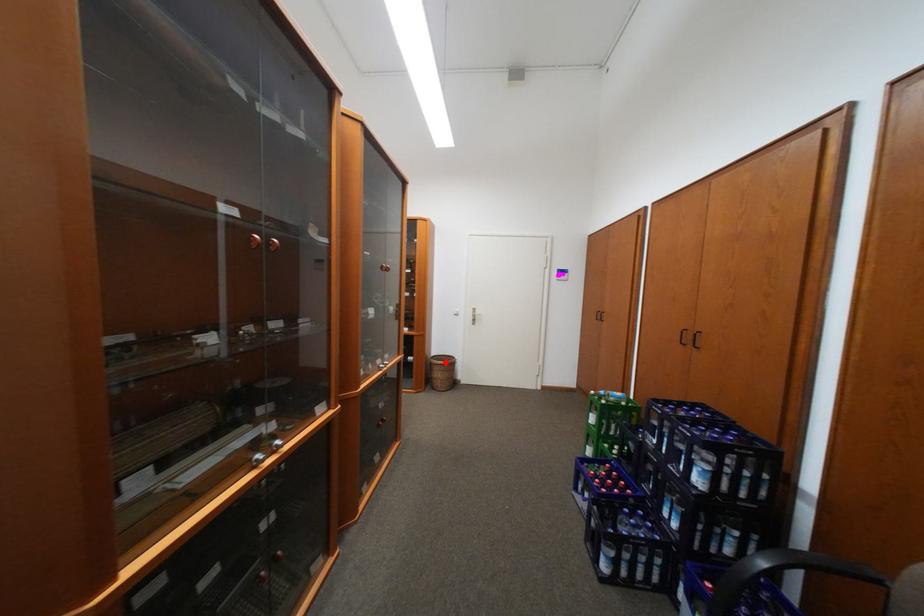
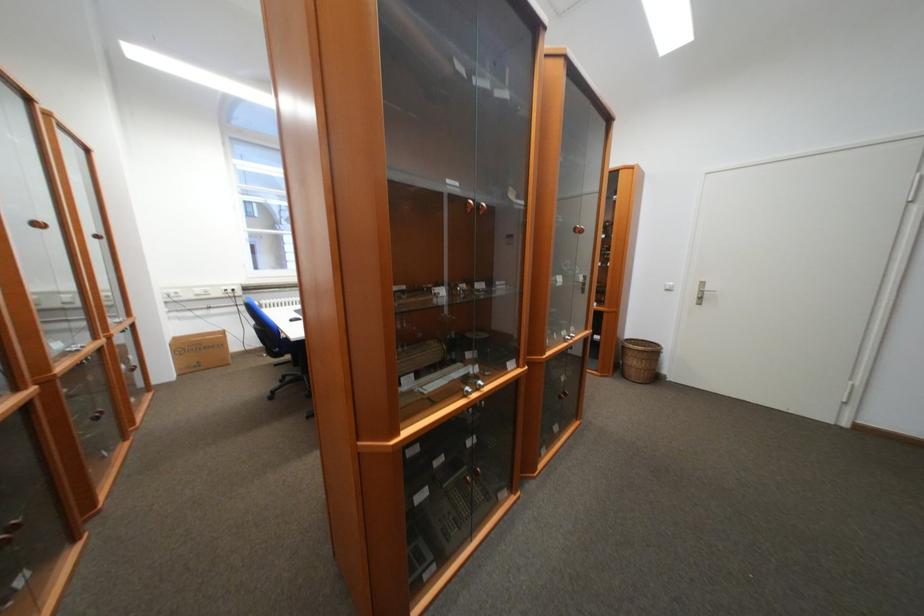
In the second image, find the point that corresponds to the highlighted location in the first image.

(640, 347)